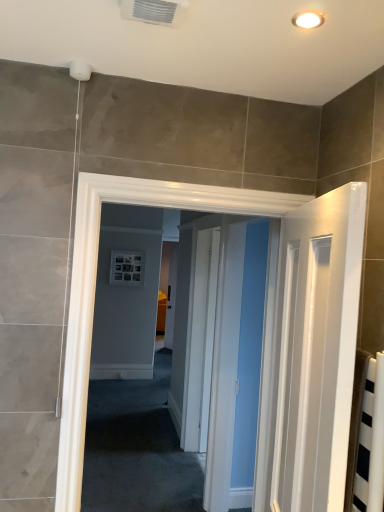
Question: Is white plastic air conditioning unit at upper center at the right side of warm matte light fixture at upper center?

Choices:
 (A) no
 (B) yes

Answer: (A)

Question: Considering the relative sizes of white plastic air conditioning unit at upper center and warm matte light fixture at upper center in the image provided, is white plastic air conditioning unit at upper center taller than warm matte light fixture at upper center?

Choices:
 (A) yes
 (B) no

Answer: (A)

Question: Is the position of white plastic air conditioning unit at upper center less distant than that of warm matte light fixture at upper center?

Choices:
 (A) yes
 (B) no

Answer: (A)

Question: Would you say warm matte light fixture at upper center is part of white plastic air conditioning unit at upper center's contents?

Choices:
 (A) yes
 (B) no

Answer: (B)

Question: From a real-world perspective, is white plastic air conditioning unit at upper center beneath warm matte light fixture at upper center?

Choices:
 (A) yes
 (B) no

Answer: (A)

Question: Is white plastic air conditioning unit at upper center facing towards warm matte light fixture at upper center?

Choices:
 (A) yes
 (B) no

Answer: (B)

Question: From the image's perspective, is warm matte light fixture at upper center under white plastic air conditioning unit at upper center?

Choices:
 (A) no
 (B) yes

Answer: (B)

Question: From a real-world perspective, is warm matte light fixture at upper center located higher than white plastic air conditioning unit at upper center?

Choices:
 (A) no
 (B) yes

Answer: (B)

Question: Does warm matte light fixture at upper center have a greater height compared to white plastic air conditioning unit at upper center?

Choices:
 (A) yes
 (B) no

Answer: (B)

Question: Would you say warm matte light fixture at upper center contains white plastic air conditioning unit at upper center?

Choices:
 (A) no
 (B) yes

Answer: (A)

Question: Considering the relative positions of warm matte light fixture at upper center and white plastic air conditioning unit at upper center in the image provided, is warm matte light fixture at upper center in front of white plastic air conditioning unit at upper center?

Choices:
 (A) yes
 (B) no

Answer: (B)

Question: Does warm matte light fixture at upper center have a lesser height compared to white plastic air conditioning unit at upper center?

Choices:
 (A) no
 (B) yes

Answer: (B)

Question: Would you say warm matte light fixture at upper center is to the left or to the right of white plastic air conditioning unit at upper center in the picture?

Choices:
 (A) left
 (B) right

Answer: (B)